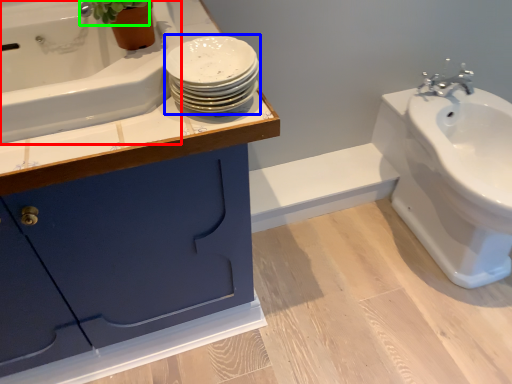
Question: Based on their relative distances, which object is nearer to bath (highlighted by a red box)? Choose from porcelain (highlighted by a blue box) and plant (highlighted by a green box).

Choices:
 (A) porcelain
 (B) plant

Answer: (B)